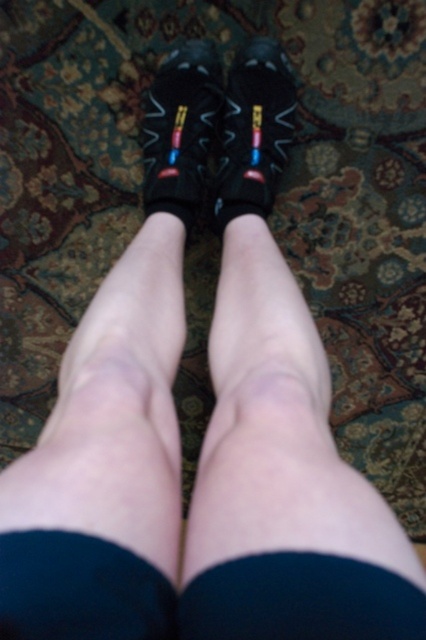
Can you confirm if black matte sock at center is taller than matte black slipper at center?

In fact, black matte sock at center may be shorter than matte black slipper at center.

Can you confirm if black matte sock at center is thinner than matte black slipper at center?

Yes, black matte sock at center is thinner than matte black slipper at center.

Between point (299, 634) and point (247, 49), which one is positioned in front?

Point (299, 634)

This screenshot has width=426, height=640. I want to click on black matte sock at center, so click(x=299, y=600).

Can you confirm if black matte sock at lower center is positioned to the left of matte black slipper at center?

Correct, you'll find black matte sock at lower center to the left of matte black slipper at center.

Does point (120, 595) lie in front of point (268, 161)?

Yes, point (120, 595) is in front of point (268, 161).

You are a GUI agent. You are given a task and a screenshot of the screen. Output one action in this format:
    pyautogui.click(x=<x>, y=<y>)
    Task: Click on the black matte sock at lower center
    The height and width of the screenshot is (640, 426).
    Given the screenshot: What is the action you would take?
    pyautogui.click(x=80, y=589)

Which is above, black matte sock at center or matte black shoe at center?

Positioned higher is matte black shoe at center.

Which of these two, black matte sock at center or matte black shoe at center, stands taller?

matte black shoe at center

The image size is (426, 640). What do you see at coordinates (299, 600) in the screenshot?
I see `black matte sock at center` at bounding box center [299, 600].

Find the location of `black matte sock at center`. black matte sock at center is located at coordinates 299,600.